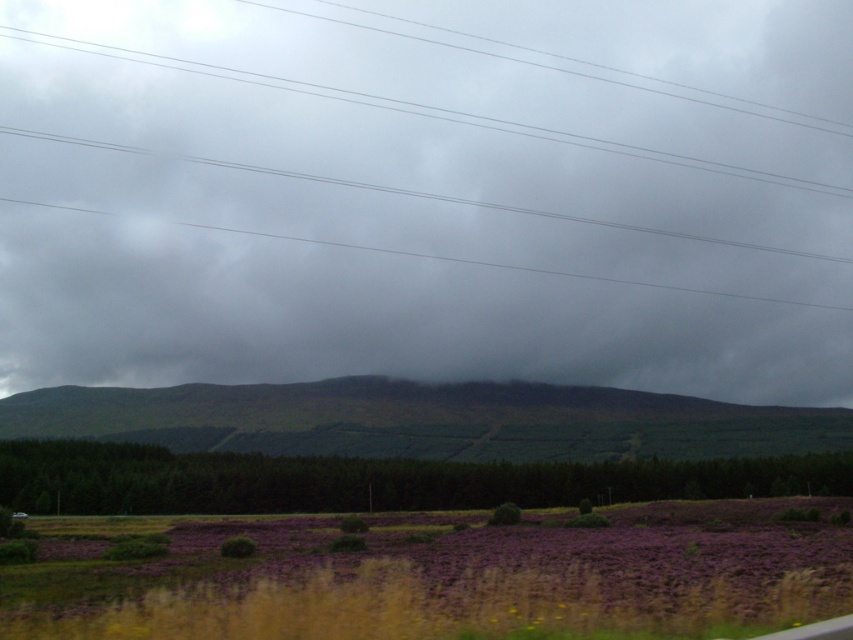
Consider the image. You are standing in the field of purple heather and looking at the gray matte cloud at center and the green grassy hill at center. Which object is located to the left of the other?

The gray matte cloud at center is positioned on the left side of green grassy hill at center.

You are a landscape photographer planning to capture the entire scene. You notice the gray matte cloud at center and the green grassy hill at center. Which one would appear larger in your photo if you focus on the center?

The gray matte cloud at center is taller than the green grassy hill at center, so it would appear larger in the photo when focused on the center.